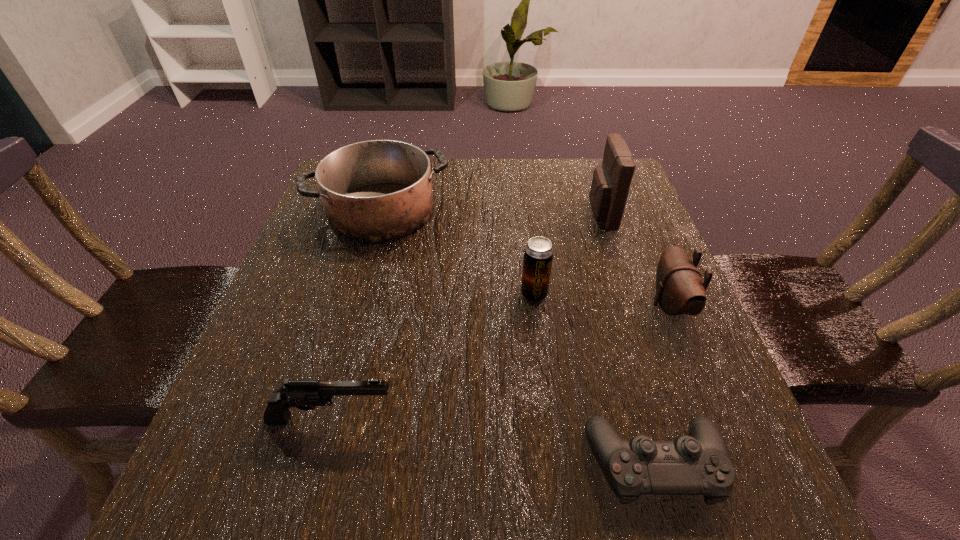
Find the location of a particular element. The image size is (960, 540). object that is at the near edge is located at coordinates [x=698, y=464].

Locate an element on the screen. saucepan present at the left edge is located at coordinates (379, 190).

At what (x,y) coordinates should I click in order to perform the action: click on gun positioned at the left edge. Please return your answer as a coordinate pair (x, y). Image resolution: width=960 pixels, height=540 pixels. Looking at the image, I should click on (303, 394).

What are the coordinates of `control at the right edge` in the screenshot? It's located at (698, 464).

What are the coordinates of `object that is at the far left corner` in the screenshot? It's located at (379, 190).

This screenshot has width=960, height=540. Identify the location of object at the far right corner. (611, 181).

I want to click on object positioned at the near right corner, so click(x=698, y=464).

The width and height of the screenshot is (960, 540). What are the coordinates of `vacant region at the far edge of the desktop` in the screenshot? It's located at (519, 172).

Locate an element on the screen. Image resolution: width=960 pixels, height=540 pixels. free space at the left edge of the desktop is located at coordinates (253, 418).

Locate an element on the screen. free spot at the right edge of the desktop is located at coordinates (644, 254).